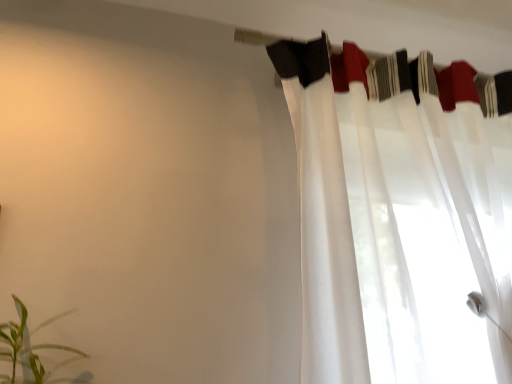
This screenshot has height=384, width=512. What do you see at coordinates (393, 223) in the screenshot?
I see `white sheer curtain at upper right` at bounding box center [393, 223].

Where is `white sheer fabric at upper center`? This screenshot has width=512, height=384. white sheer fabric at upper center is located at coordinates (426, 81).

Does white sheer curtain at upper right touch white sheer fabric at upper center?

No, white sheer curtain at upper right is not touching white sheer fabric at upper center.

From the image's perspective, is white sheer curtain at upper right on white sheer fabric at upper center?

Incorrect, from the image's perspective, white sheer curtain at upper right is lower than white sheer fabric at upper center.

Who is shorter, white sheer curtain at upper right or white sheer fabric at upper center?

Standing shorter between the two is white sheer fabric at upper center.

Measure the distance between white sheer curtain at upper right and white sheer fabric at upper center.

A distance of 8.57 inches exists between white sheer curtain at upper right and white sheer fabric at upper center.

Can you confirm if white sheer curtain at upper right is positioned to the right of green leafy plant at lower left?

Indeed, white sheer curtain at upper right is positioned on the right side of green leafy plant at lower left.

From the image's perspective, is white sheer curtain at upper right on top of green leafy plant at lower left?

Yes, from the image's perspective, white sheer curtain at upper right is over green leafy plant at lower left.

Is white sheer curtain at upper right aimed at green leafy plant at lower left?

No, white sheer curtain at upper right is not oriented towards green leafy plant at lower left.

Which of these two, white sheer curtain at upper right or green leafy plant at lower left, is wider?

Wider between the two is white sheer curtain at upper right.

Does green leafy plant at lower left have a greater width compared to white sheer fabric at upper center?

Yes, green leafy plant at lower left is wider than white sheer fabric at upper center.

Considering the sizes of objects green leafy plant at lower left and white sheer fabric at upper center in the image provided, who is taller, green leafy plant at lower left or white sheer fabric at upper center?

green leafy plant at lower left.

From the image's perspective, is green leafy plant at lower left located above white sheer fabric at upper center?

No, from the image's perspective, green leafy plant at lower left is not on top of white sheer fabric at upper center.

Locate an element on the screen. houseplant that appears in front of the white sheer fabric at upper center is located at coordinates (33, 352).

From a real-world perspective, who is located higher, green leafy plant at lower left or white sheer curtain at upper right?

From a 3D spatial view, white sheer curtain at upper right is above.

Does green leafy plant at lower left have a greater width compared to white sheer curtain at upper right?

In fact, green leafy plant at lower left might be narrower than white sheer curtain at upper right.

At what (x,y) coordinates should I click in order to perform the action: click on curtain behind the green leafy plant at lower left. Please return your answer as a coordinate pair (x, y). This screenshot has width=512, height=384. Looking at the image, I should click on (393, 223).

Does point (22, 361) come behind point (341, 333)?

No.

Can you confirm if white sheer fabric at upper center is shorter than green leafy plant at lower left?

Indeed, white sheer fabric at upper center has a lesser height compared to green leafy plant at lower left.

Is white sheer fabric at upper center located outside green leafy plant at lower left?

Yes, white sheer fabric at upper center is outside of green leafy plant at lower left.

Does white sheer fabric at upper center have a larger size compared to green leafy plant at lower left?

Incorrect, white sheer fabric at upper center is not larger than green leafy plant at lower left.

From the picture: From a real-world perspective, between white sheer fabric at upper center and green leafy plant at lower left, who is vertically lower?

In real-world perspective, green leafy plant at lower left is lower.

Measure the distance between white sheer fabric at upper center and white sheer curtain at upper right.

white sheer fabric at upper center is 8.57 inches away from white sheer curtain at upper right.

What's the angular difference between white sheer fabric at upper center and white sheer curtain at upper right's facing directions?

0.000808 degrees.

Can you confirm if white sheer fabric at upper center is shorter than white sheer curtain at upper right?

Correct, white sheer fabric at upper center is not as tall as white sheer curtain at upper right.

From the image's perspective, is white sheer fabric at upper center under white sheer curtain at upper right?

Incorrect, from the image's perspective, white sheer fabric at upper center is higher than white sheer curtain at upper right.

At what (x,y) coordinates should I click in order to perform the action: click on curtain in front of the white sheer fabric at upper center. Please return your answer as a coordinate pair (x, y). Image resolution: width=512 pixels, height=384 pixels. Looking at the image, I should click on (393, 223).

The image size is (512, 384). In order to click on houseplant below the white sheer curtain at upper right (from a real-world perspective) in this screenshot , I will do `click(33, 352)`.

Considering their positions, is white sheer curtain at upper right positioned closer to green leafy plant at lower left than white sheer fabric at upper center?

white sheer curtain at upper right is positioned closer to the anchor green leafy plant at lower left.

From the picture: Looking at the image, which one is located closer to white sheer curtain at upper right, green leafy plant at lower left or white sheer fabric at upper center?

Based on the image, white sheer fabric at upper center appears to be nearer to white sheer curtain at upper right.

Which object lies further to the anchor point white sheer curtain at upper right, white sheer fabric at upper center or green leafy plant at lower left?

Among the two, green leafy plant at lower left is located further to white sheer curtain at upper right.

When comparing their distances from green leafy plant at lower left, does white sheer fabric at upper center or white sheer curtain at upper right seem further?

The object further to green leafy plant at lower left is white sheer fabric at upper center.

When comparing their distances from white sheer fabric at upper center, does white sheer curtain at upper right or green leafy plant at lower left seem further?

Based on the image, green leafy plant at lower left appears to be further to white sheer fabric at upper center.

From the picture: When comparing their distances from white sheer fabric at upper center, does green leafy plant at lower left or white sheer curtain at upper right seem closer?

white sheer curtain at upper right lies closer to white sheer fabric at upper center than the other object.

Locate an element on the screen. The height and width of the screenshot is (384, 512). clothesline between green leafy plant at lower left and white sheer curtain at upper right from left to right is located at coordinates (426, 81).